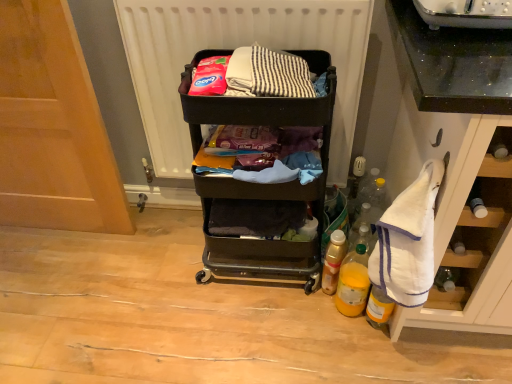
What are the coordinates of `vacant space to the right of yellow translucent bottle at lower right, arranged as the 3th bottle when viewed from the left` in the screenshot? It's located at (428, 339).